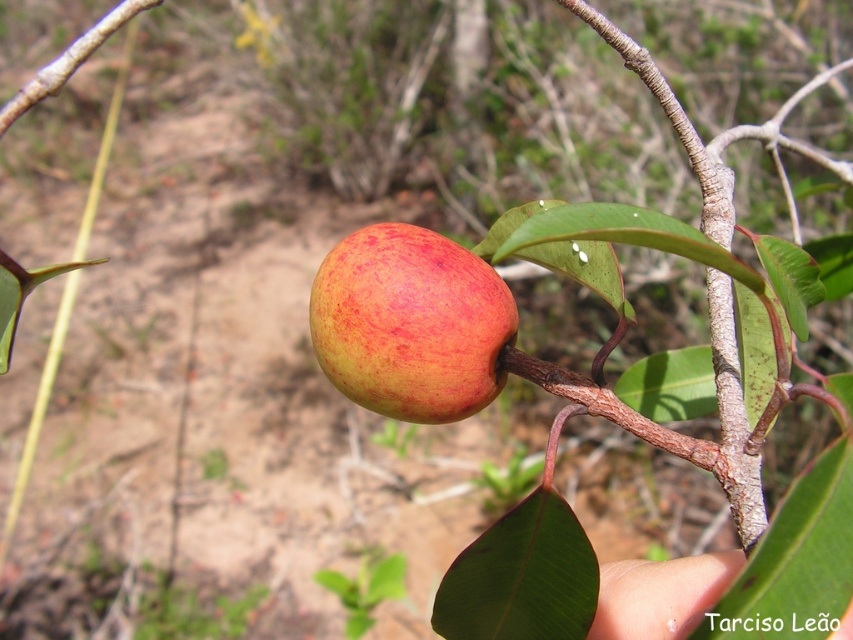
Which is behind, point (496, 381) or point (596, 608)?

Point (496, 381)

Can you confirm if ripe red apple at center is thinner than pale skin at lower right?

No.

Who is more forward, (x=376, y=364) or (x=724, y=563)?

Point (x=724, y=563) is more forward.

This screenshot has width=853, height=640. Identify the location of ripe red apple at center. (410, 323).